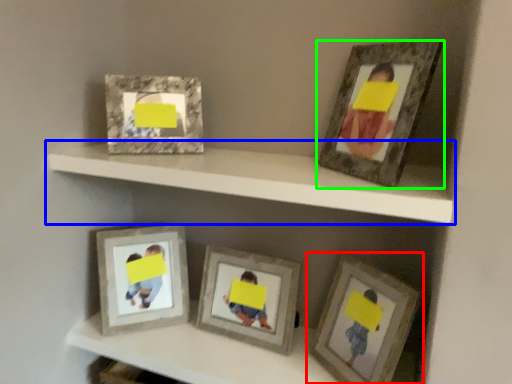
Question: Which is farther away from picture frame (highlighted by a red box)? shelf (highlighted by a blue box) or picture frame (highlighted by a green box)?

Choices:
 (A) shelf
 (B) picture frame

Answer: (B)